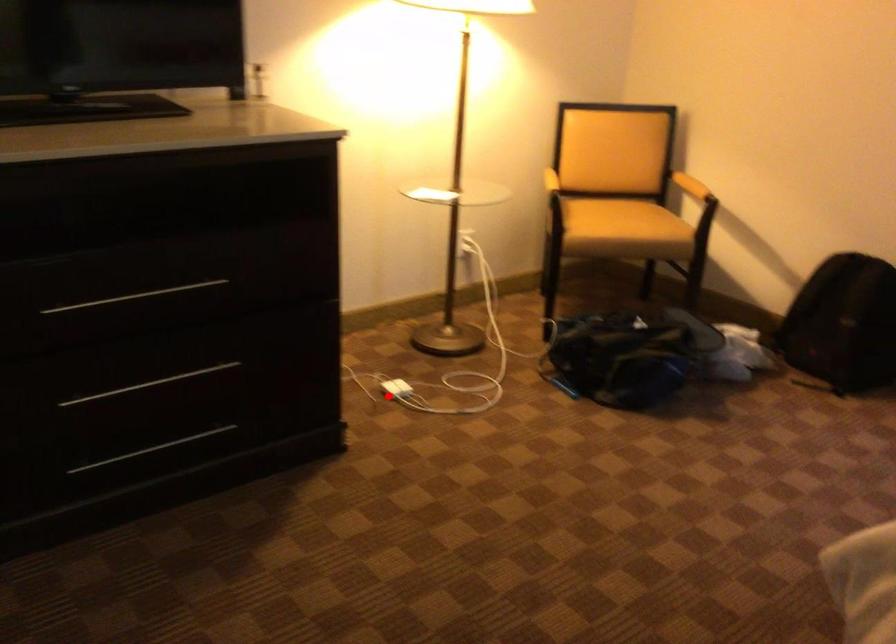
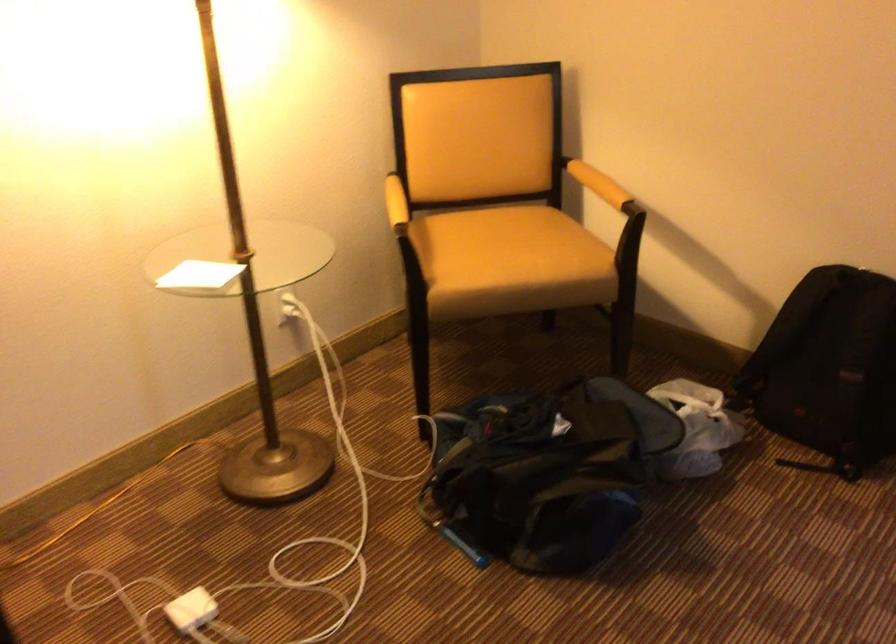
Locate, in the second image, the point that corresponds to the highlighted location in the first image.

(192, 609)